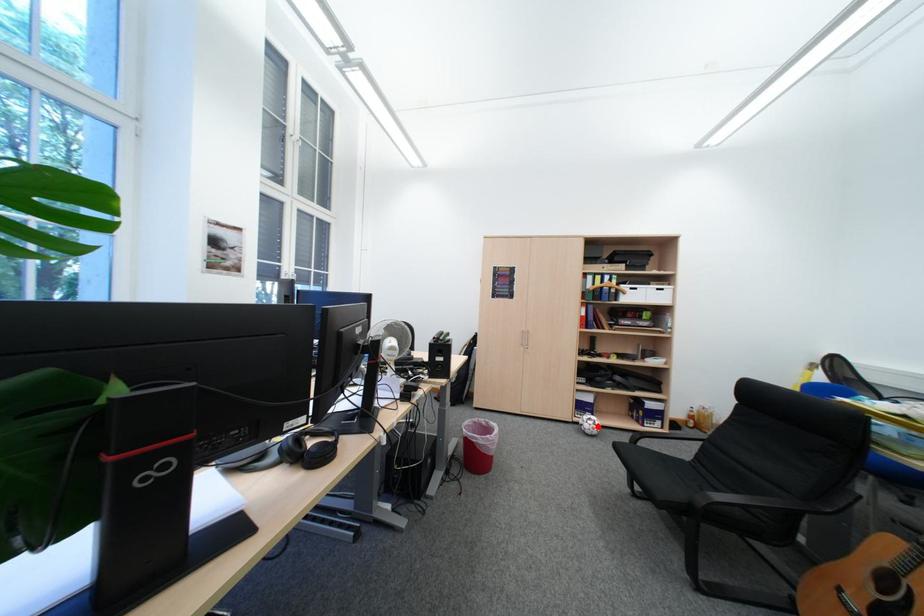
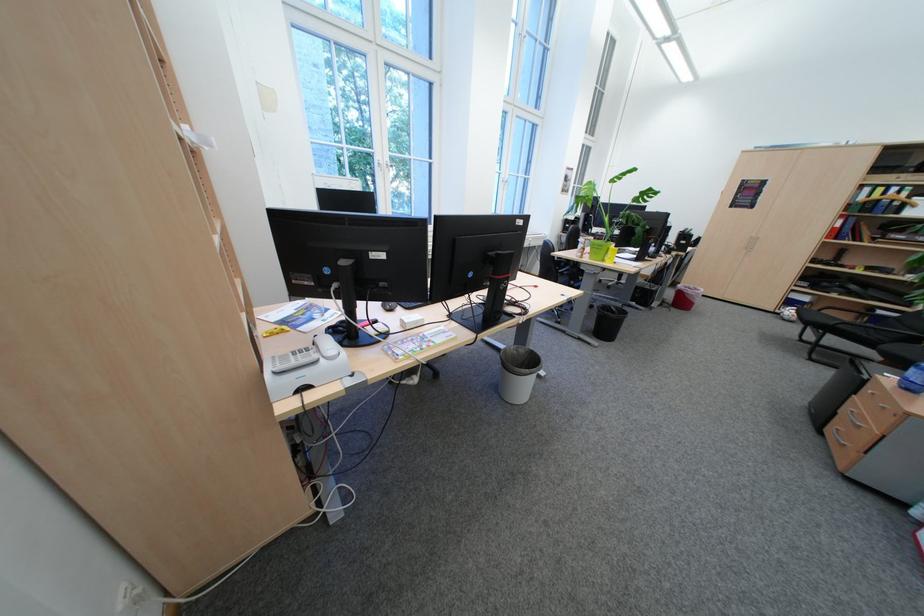
Locate, in the second image, the point that corresponds to the highlighted location in the first image.

(798, 314)